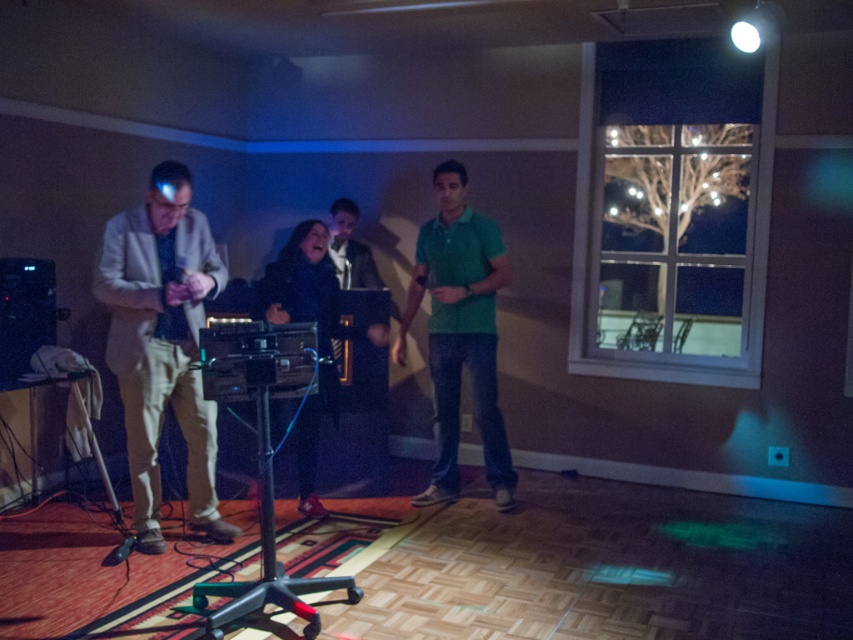
You are standing in the center of the room and want to move towards the light beige fabric suit at left. Which direction should you move to reach it?

You should move towards the left to reach the light beige fabric suit at left since it is located at point (x=161, y=344), which is to the left side of the room.

Based on the photo, you are organizing a photo shoot and need to arrange two performers wearing the light beige fabric suit at left and green matte shirt at center. Based on their sizes, which performer should you place closer to the camera to ensure both are visible in the frame?

The light beige fabric suit at left is bigger than the green matte shirt at center, so you should place the performer in the light beige fabric suit at left closer to the camera to ensure both are visible in the frame.

You are standing in the room and want to locate the green matte shirt at center. According to the coordinates provided, where should you look?

The green matte shirt at center is located at point coordinates (459,332).